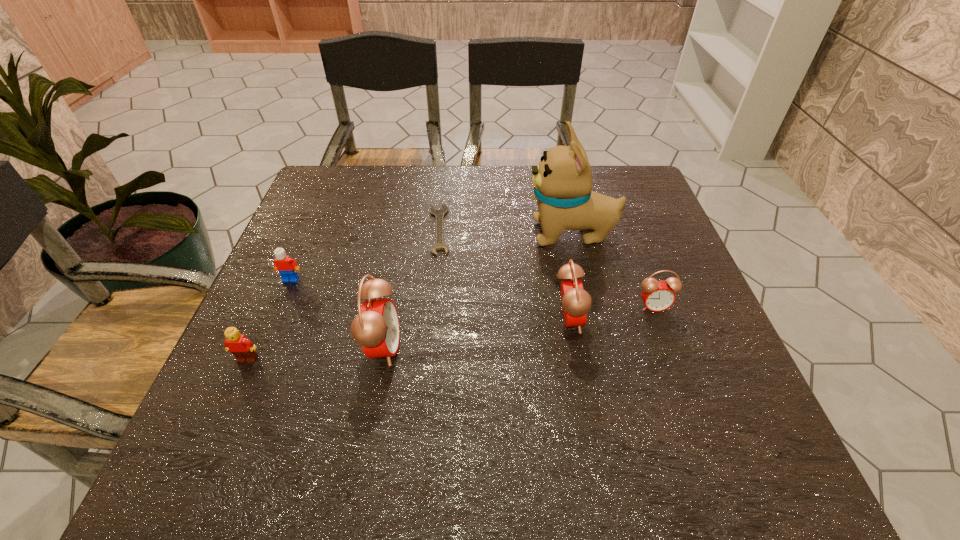
At what (x,y) coordinates should I click in order to perform the action: click on alarm clock that is at the right edge. Please return your answer as a coordinate pair (x, y). Looking at the image, I should click on (657, 296).

What are the coordinates of `puppy at the right edge` in the screenshot? It's located at (562, 181).

The height and width of the screenshot is (540, 960). In the image, there is a desktop. Find the location of `vacant space at the far edge`. vacant space at the far edge is located at coordinates (389, 167).

Identify the location of vacant space at the near edge of the desktop. The width and height of the screenshot is (960, 540). (420, 407).

At what (x,y) coordinates should I click in order to perform the action: click on free space at the left edge of the desktop. Please return your answer as a coordinate pair (x, y). The height and width of the screenshot is (540, 960). Looking at the image, I should click on (272, 342).

This screenshot has height=540, width=960. Find the location of `free region at the right edge of the desktop`. free region at the right edge of the desktop is located at coordinates (694, 339).

Identify the location of vacant space at the far left corner. This screenshot has height=540, width=960. (309, 196).

The width and height of the screenshot is (960, 540). What are the coordinates of `vacant space at the near left corner of the desktop` in the screenshot? It's located at (281, 390).

At what (x,y) coordinates should I click in order to perform the action: click on vacant space at the far right corner. Please return your answer as a coordinate pair (x, y). Looking at the image, I should click on (624, 191).

Identify the location of free space between the third object from left to right and the wrench. The height and width of the screenshot is (540, 960). (411, 288).